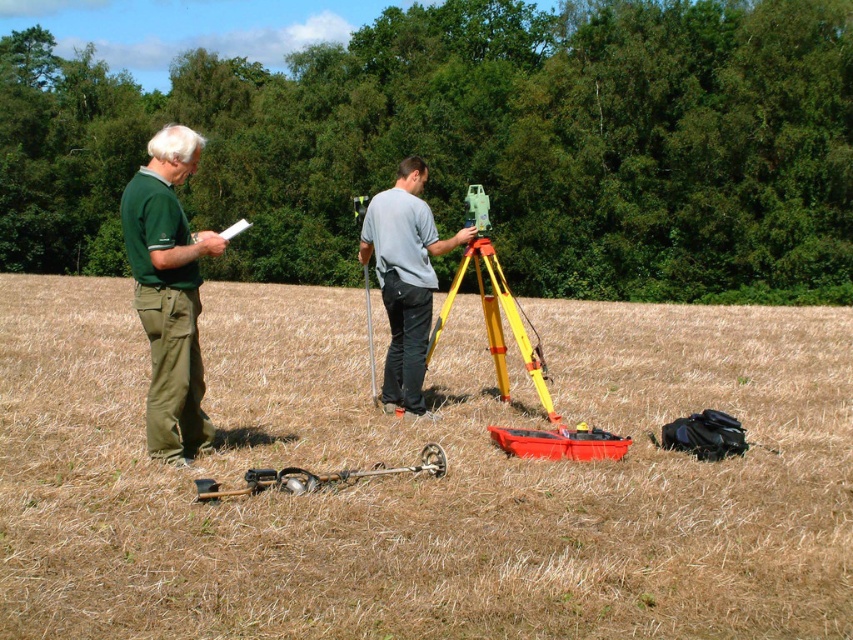
Question: Is gray matte shirt at center positioned in front of yellow/yellowish metal tripod at center?

Choices:
 (A) no
 (B) yes

Answer: (B)

Question: In this image, where is yellow plastic tripod at center located relative to yellow/yellowish metal tripod at center?

Choices:
 (A) above
 (B) below

Answer: (A)

Question: Is metallic silver detector at lower center to the right of orange plastic bag at center from the viewer's perspective?

Choices:
 (A) yes
 (B) no

Answer: (B)

Question: Which of the following is the farthest from the observer?

Choices:
 (A) (181, 353)
 (B) (718, 413)
 (C) (601, 435)

Answer: (B)

Question: Among these objects, which one is farthest from the camera?

Choices:
 (A) orange plastic bag at center
 (B) black fabric bag at lower right
 (C) yellow/yellowish metal tripod at center
 (D) green plastic surveying instrument at center

Answer: (D)

Question: Which point appears farthest from the camera in this image?

Choices:
 (A) (492, 428)
 (B) (683, 440)
 (C) (474, 227)
 (D) (541, 376)

Answer: (C)